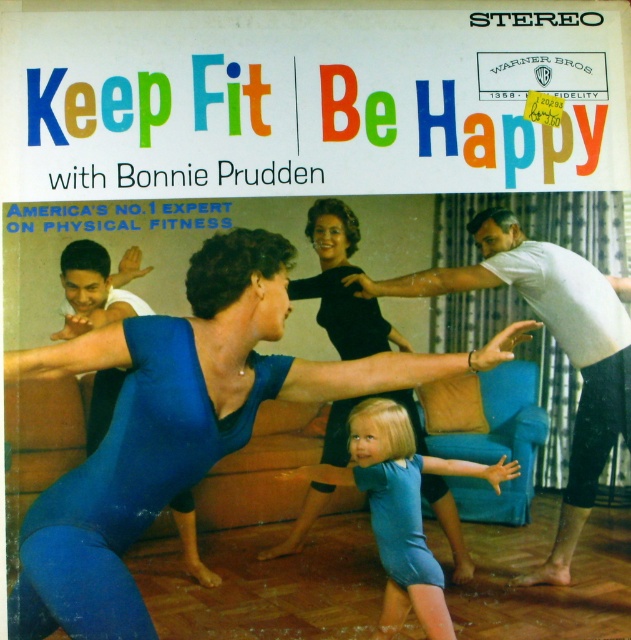
You are a photographer trying to capture a closeup of the blue denim shorts at center and the blue fabric child at center for a fitness magazine. Since the camera can only focus on one subject at a time, which object should you choose to ensure it appears larger in the photo?

The blue denim shorts at center has a larger size compared to the blue fabric child at center, so to ensure the subject appears larger in the photo, the photographer should focus on the blue denim shorts at center.

You are a photographer trying to capture a photo of the blue denim shorts at center and the blue fabric child at center for a fitness magazine. Since you want to highlight both subjects, which one should you focus on first if you want to ensure the shorter object is in focus first?

The blue denim shorts at center has a lesser height compared to the blue fabric child at center, so you should focus on the blue denim shorts at center first to ensure the shorter object is in focus.

You are a photographer trying to capture a closeup of the blue spandex leotard at center and the blue denim shorts at center in the image. Which clothing item will appear larger in your photo?

The blue spandex leotard at center will appear larger in the photo because it is closer to the viewer than the blue denim shorts at center.